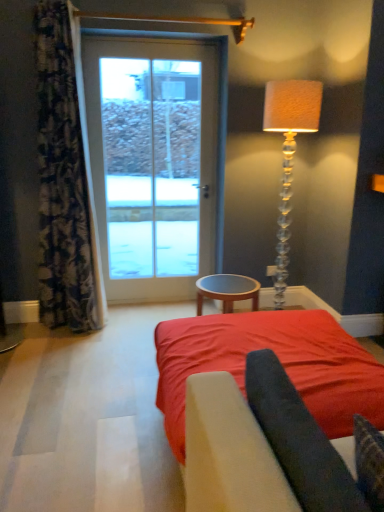
Question: Does white glass door at center come in front of floral fabric curtain at left?

Choices:
 (A) no
 (B) yes

Answer: (A)

Question: Does white glass door at center have a smaller size compared to floral fabric curtain at left?

Choices:
 (A) yes
 (B) no

Answer: (A)

Question: Can you confirm if white glass door at center is wider than floral fabric curtain at left?

Choices:
 (A) yes
 (B) no

Answer: (B)

Question: Is white glass door at center aimed at floral fabric curtain at left?

Choices:
 (A) no
 (B) yes

Answer: (A)

Question: Is white glass door at center at the left side of floral fabric curtain at left?

Choices:
 (A) yes
 (B) no

Answer: (B)

Question: Is white glass door at center oriented away from floral fabric curtain at left?

Choices:
 (A) yes
 (B) no

Answer: (B)

Question: Is the position of floral fabric curtain at left less distant than that of red fabric bed at center?

Choices:
 (A) yes
 (B) no

Answer: (B)

Question: Is floral fabric curtain at left positioned behind red fabric bed at center?

Choices:
 (A) yes
 (B) no

Answer: (A)

Question: From the image's perspective, does floral fabric curtain at left appear higher than red fabric bed at center?

Choices:
 (A) yes
 (B) no

Answer: (A)

Question: Is floral fabric curtain at left to the left of red fabric bed at center from the viewer's perspective?

Choices:
 (A) yes
 (B) no

Answer: (A)

Question: Can you confirm if floral fabric curtain at left is thinner than red fabric bed at center?

Choices:
 (A) no
 (B) yes

Answer: (B)

Question: Considering the relative sizes of floral fabric curtain at left and red fabric bed at center in the image provided, is floral fabric curtain at left wider than red fabric bed at center?

Choices:
 (A) no
 (B) yes

Answer: (A)

Question: Can you confirm if floral fabric curtain at left is shorter than translucent glass floor lamp at right?

Choices:
 (A) yes
 (B) no

Answer: (B)